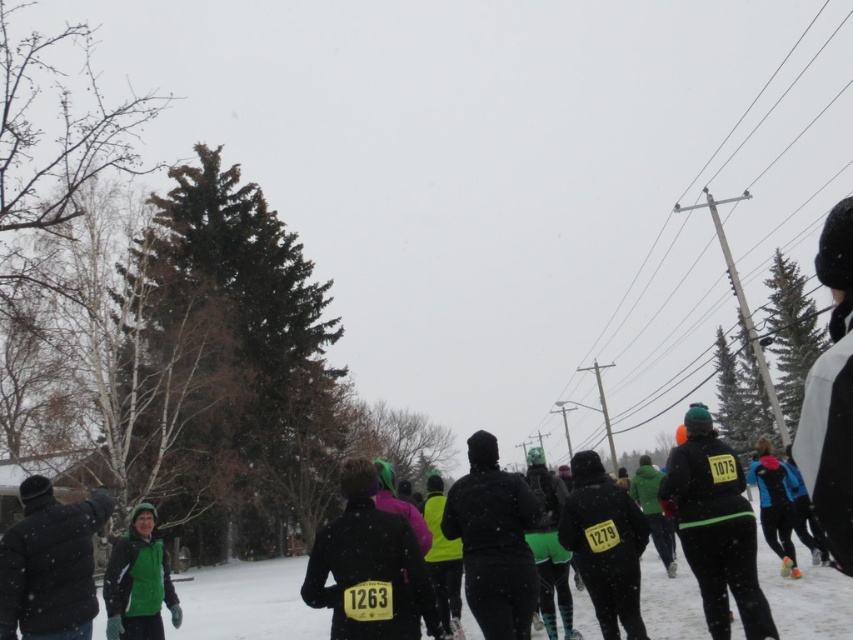
You are a photographer standing at the starting line of the winter event. You want to capture a photo of the dark green jacket at lower left without moving from your current position. Is the camera within reach to do so?

The dark green jacket at lower left and camera are 20.95 feet apart. Since the distance is over 20 feet, the camera is too far to reach without moving from your current position.

Based on the photo, you are a photographer at the winter event and want to capture both the dark green jacket at lower left and the green fleece jacket at lower left in a single shot. Which jacket should you focus on first to ensure both are in frame?

The dark green jacket at lower left is located above the green fleece jacket at lower left, so focusing on the dark green jacket at lower left first will ensure both are within the frame.